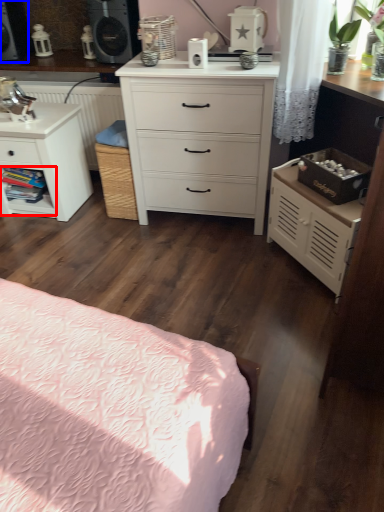
Question: Among these objects, which one is nearest to the camera, shelf (highlighted by a red box) or speaker (highlighted by a blue box)?

Choices:
 (A) shelf
 (B) speaker

Answer: (B)